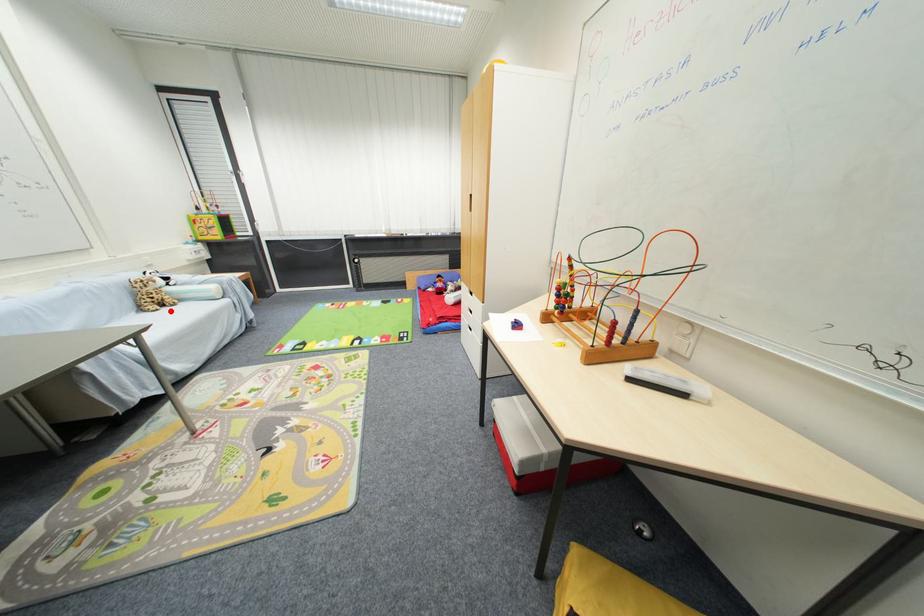
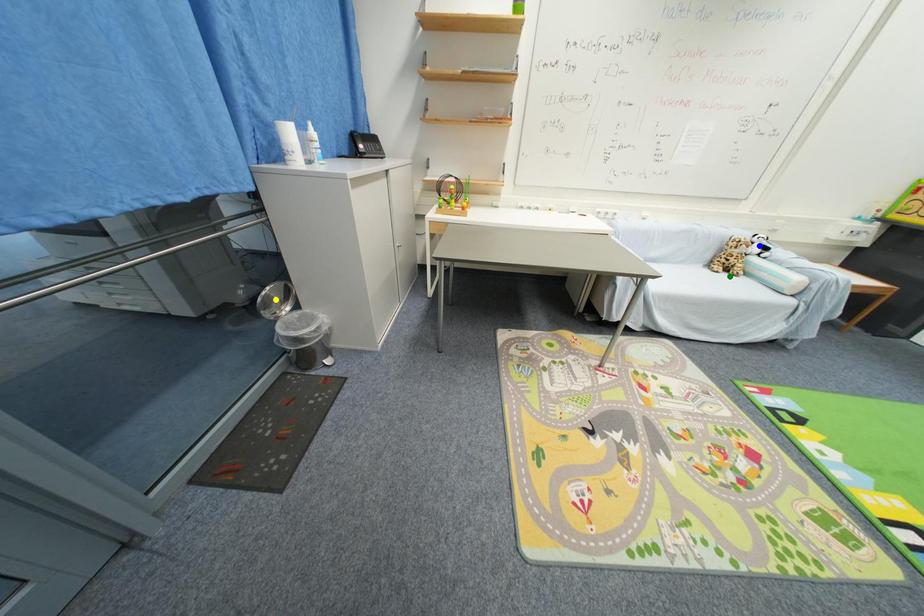
Question: I am providing you with two images of the same scene from different viewpoints. A red point is marked on the first image. You are given multiple points on the second image. Can you choose the point in image 2 that corresponds to the point in image 1?

Choices:
 (A) yellow point
 (B) green point
 (C) blue point

Answer: (B)